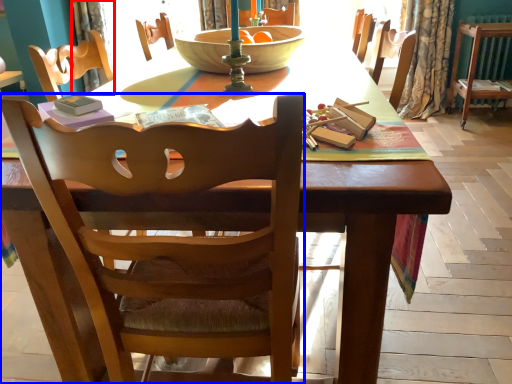
Question: Which point is further to the camera, curtain (highlighted by a red box) or chair (highlighted by a blue box)?

Choices:
 (A) curtain
 (B) chair

Answer: (A)